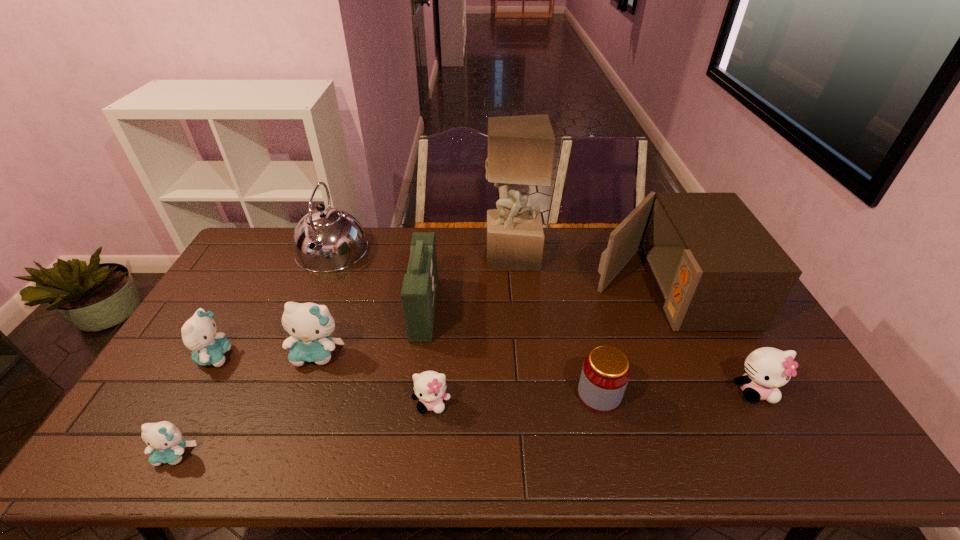
The height and width of the screenshot is (540, 960). In order to click on vacant area situated 0.080m with the door open on the front of the microwave oven in this screenshot , I will do `click(568, 286)`.

Image resolution: width=960 pixels, height=540 pixels. What are the coordinates of `vacant space situated with the door open on the front of the microwave oven` in the screenshot? It's located at (533, 286).

Find the location of a particular element. The height and width of the screenshot is (540, 960). vacant area located 0.190m with the door open on the front of the microwave oven is located at coordinates (536, 286).

Locate an element on the screen. free space located on the front-facing side of the first-aid kit is located at coordinates (485, 308).

Find the location of a particular element. This screenshot has width=960, height=540. vacant space located on the face of the rightmost blue kitten is located at coordinates (290, 429).

Where is `vacant space located 0.220m on the face of the second biggest blue kitten`? Image resolution: width=960 pixels, height=540 pixels. vacant space located 0.220m on the face of the second biggest blue kitten is located at coordinates (308, 356).

Find the location of a particular element. This screenshot has width=960, height=540. vacant position located on the front-facing side of the bigger white kitten is located at coordinates (785, 447).

Where is `vacant space located on the left of the eighth object from left to right`? The image size is (960, 540). vacant space located on the left of the eighth object from left to right is located at coordinates (479, 395).

Identify the location of free location located on the front-facing side of the smaller white kitten. This screenshot has height=540, width=960. (429, 435).

Where is `sculpture that is at the far edge`? Image resolution: width=960 pixels, height=540 pixels. sculpture that is at the far edge is located at coordinates (521, 148).